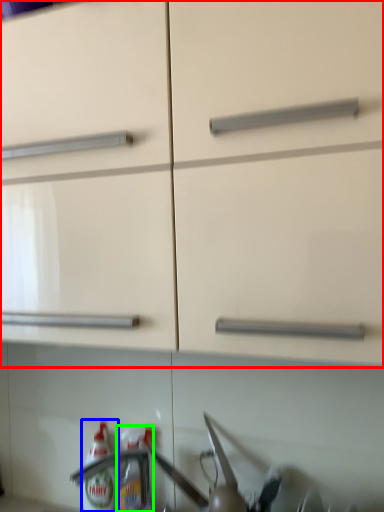
Question: Considering the real-world distances, which object is farthest from cabinetry (highlighted by a red box)? bottle (highlighted by a blue box) or bottle (highlighted by a green box)?

Choices:
 (A) bottle
 (B) bottle

Answer: (A)